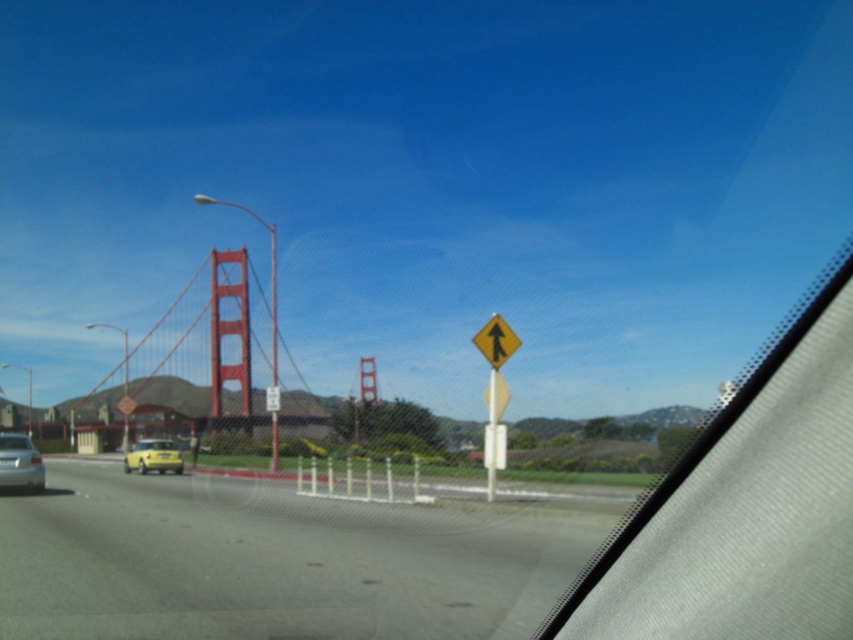
Question: Can you confirm if yellow matte diamond at center is thinner than yellow matte car at center?

Choices:
 (A) yes
 (B) no

Answer: (A)

Question: Which point appears closest to the camera in this image?

Choices:
 (A) (488, 397)
 (B) (35, 484)

Answer: (A)

Question: Considering the real-world distances, which object is farthest from the yellow matte car at center?

Choices:
 (A) yellow matte diamond at center
 (B) yellow matte traffic sign at center
 (C) silver metallic car at lower left

Answer: (A)

Question: Does yellow matte diamond at center lie in front of yellow matte car at center?

Choices:
 (A) no
 (B) yes

Answer: (B)

Question: Is silver metallic car at lower left thinner than yellow matte car at center?

Choices:
 (A) no
 (B) yes

Answer: (B)

Question: Which of these objects is positioned closest to the silver metallic car at lower left?

Choices:
 (A) yellow matte traffic sign at center
 (B) yellow matte car at center

Answer: (A)